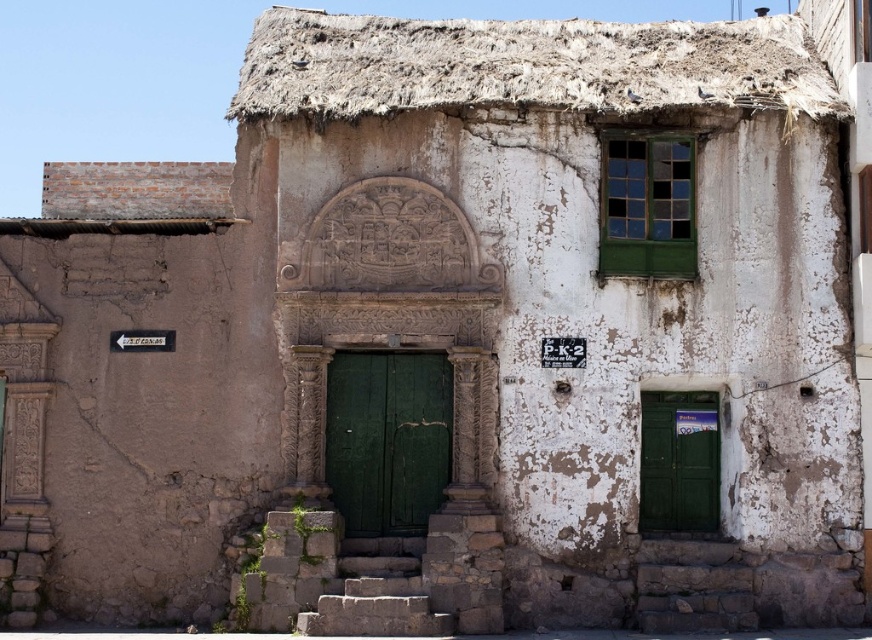
You are standing in front of the old rustic building. There are two points marked on the building. The first point is at coordinates point (417, 509) and the second is at point (664, 417). Which point is closer to you?

Point (417, 509) is closer to the camera than point (664, 417).

You are a painter who needs to decide which door to paint first. The green wooden door at center and the green matte door at lower right are both in need of a fresh coat. Based on their sizes, which door requires more paint?

The green wooden door at center requires more paint because it has a larger size compared to the green matte door at lower right.

You are standing in front of an old rustic building. You see a green wooden door at center and a green matte door at lower right. Which door is higher up?

The green wooden door at center is located above the green matte door at lower right, so it is higher up.